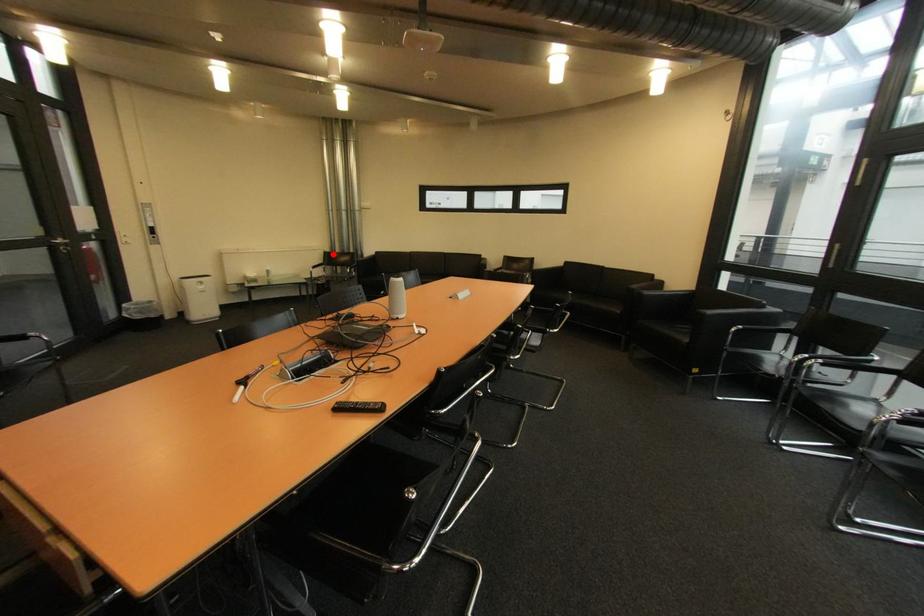
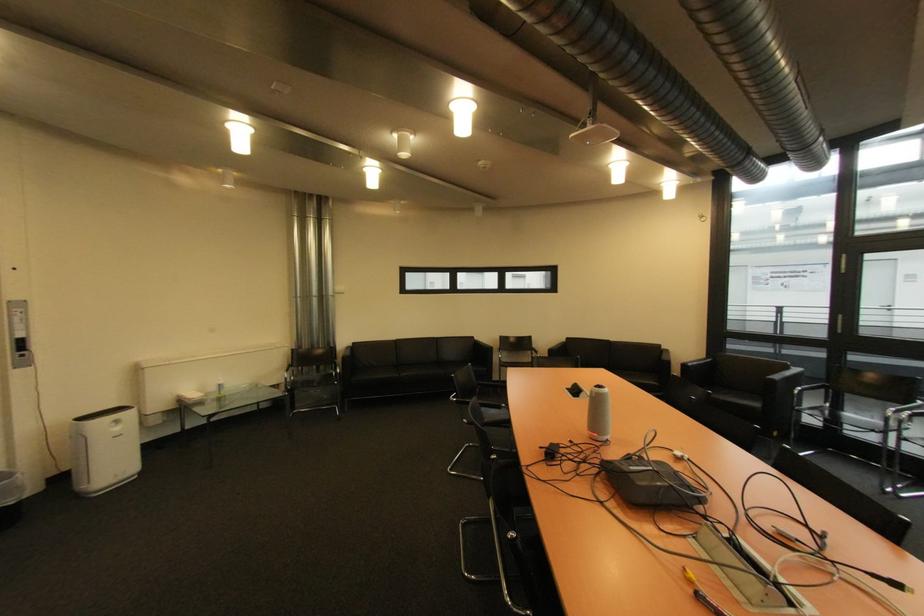
Where in the second image is the point corresponding to the highlighted location from the first image?

(301, 352)